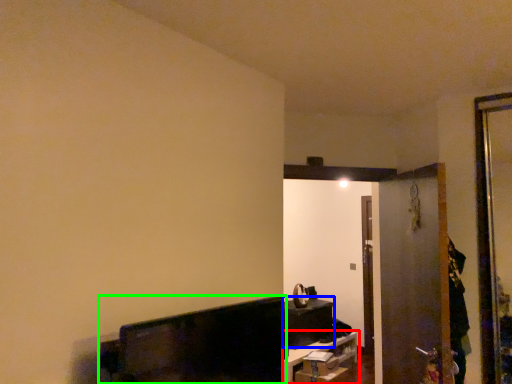
Question: Based on their relative distances, which object is farther from furniture (highlighted by a red box)? Choose from furniture (highlighted by a blue box) and furniture (highlighted by a green box).

Choices:
 (A) furniture
 (B) furniture

Answer: (B)